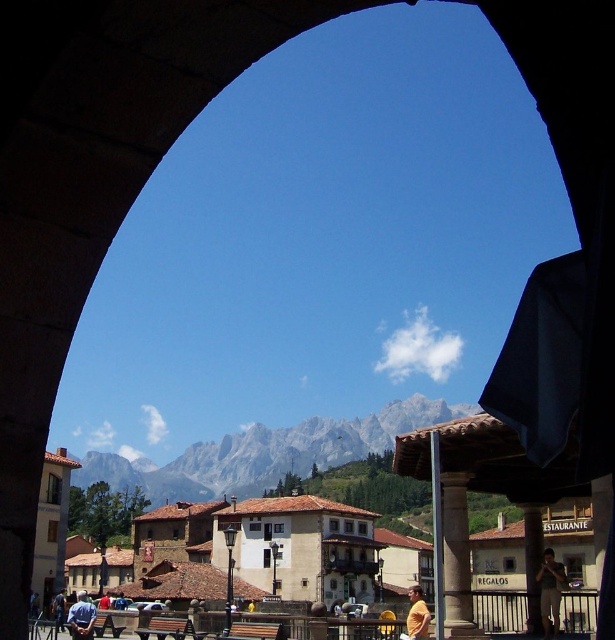
Does dark brown leather jacket at lower right come in front of yellow matte shirt at lower center?

Yes, dark brown leather jacket at lower right is in front of yellow matte shirt at lower center.

Is dark brown leather jacket at lower right taller than yellow matte shirt at lower center?

In fact, dark brown leather jacket at lower right may be shorter than yellow matte shirt at lower center.

The image size is (615, 640). Identify the location of dark brown leather jacket at lower right. (549, 593).

The height and width of the screenshot is (640, 615). Describe the element at coordinates (81, 618) in the screenshot. I see `blue fabric shirt at lower left` at that location.

Can you confirm if blue fabric shirt at lower left is positioned below blue shirt at lower left?

Yes.

Locate an element on the screen. Image resolution: width=615 pixels, height=640 pixels. blue fabric shirt at lower left is located at coordinates (81, 618).

Is dark brown leather jacket at lower right further to the viewer compared to blue shirt at lower left?

No, it is not.

Which is above, dark brown leather jacket at lower right or blue shirt at lower left?

dark brown leather jacket at lower right is above.

Who is more distant from viewer, (547, 621) or (55, 596)?

Point (55, 596)

At what (x,y) coordinates should I click in order to perform the action: click on dark brown leather jacket at lower right. Please return your answer as a coordinate pair (x, y). This screenshot has width=615, height=640. Looking at the image, I should click on (549, 593).